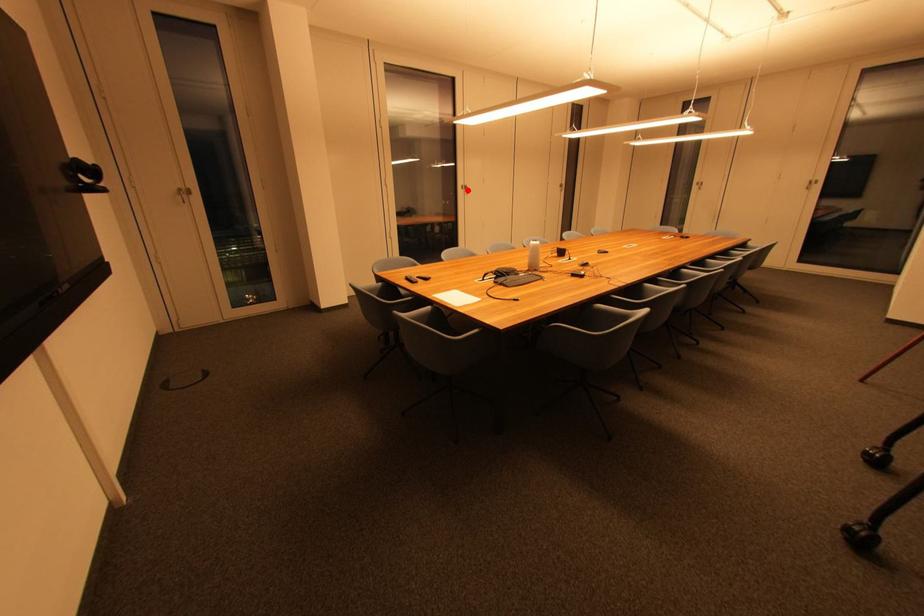
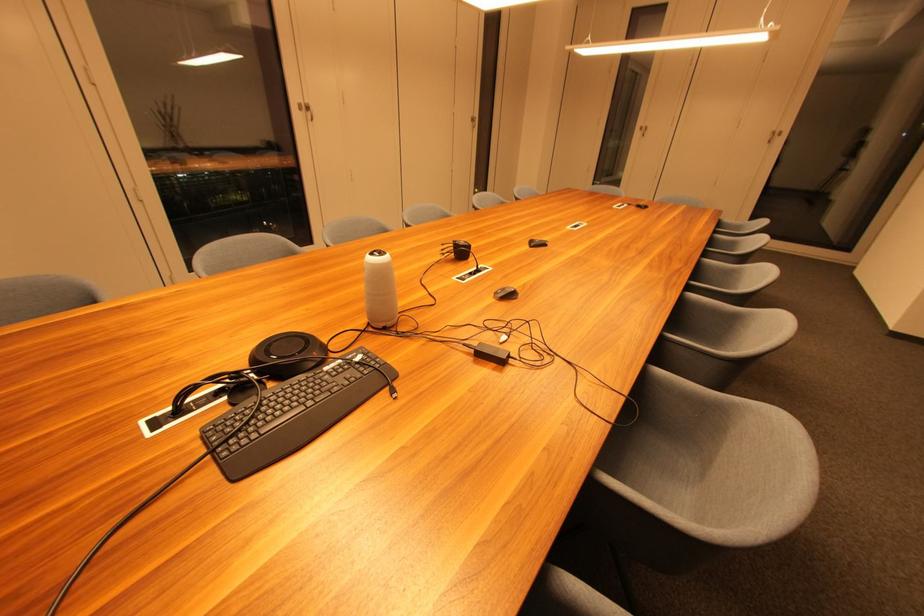
In the second image, find the point that corresponds to the highlighted location in the first image.

(306, 111)